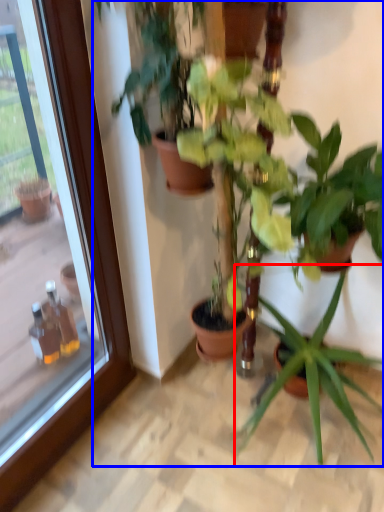
Question: Among these objects, which one is farthest to the camera, houseplant (highlighted by a red box) or houseplant (highlighted by a blue box)?

Choices:
 (A) houseplant
 (B) houseplant

Answer: (A)